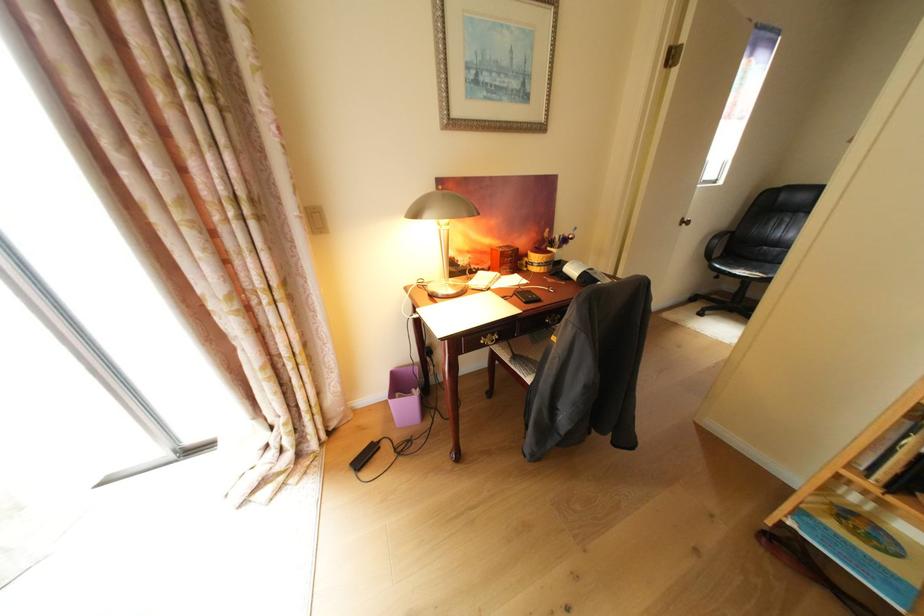
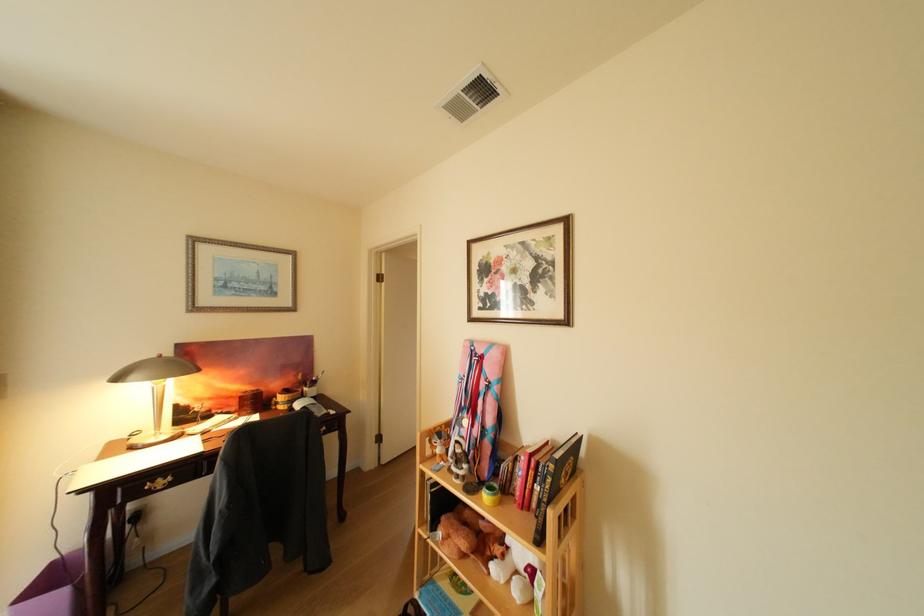
In the second image, find the point that corresponds to [494,344] in the first image.

(160, 490)